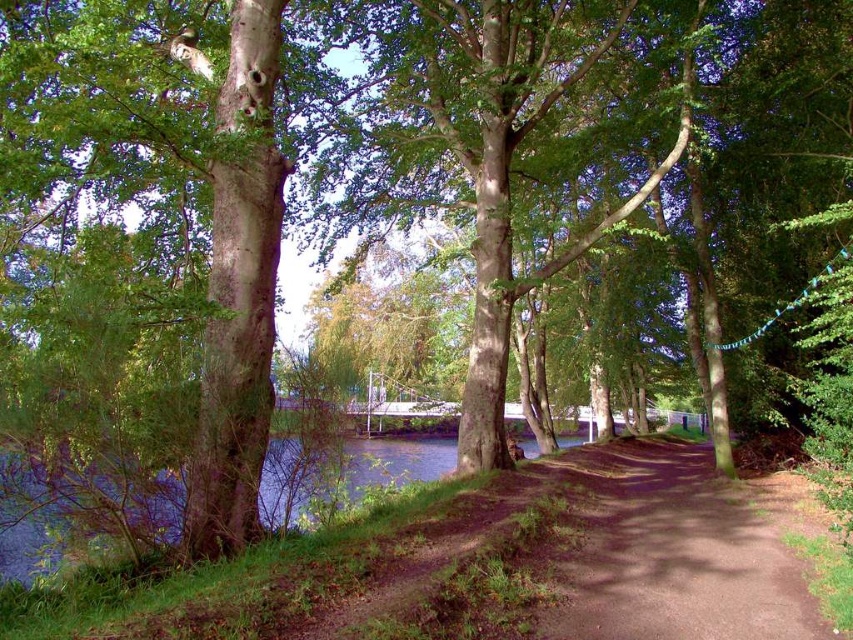
Based on the photo, you are a hiker walking along the brown dirt path at center. You notice the green leafy tree at center ahead. Can you walk under the tree without leaving the path?

The green leafy tree at center is bigger than the brown dirt path at center, so yes, you can walk under the tree without leaving the path because the tree is wider than the path.

Consider the image. You are walking along the brown dirt path at center and want to take a photo of the green leafy tree at center. Which direction should you face to capture the tree in your viewfinder?

The green leafy tree at center is positioned on the left side of brown dirt path at center, so you should face to the left to capture the tree in your viewfinder.

You are standing at the riverside and want to take a photo of the green leafy tree at center. If your camera can focus on objects up to 40 feet away, will it be able to capture the tree clearly?

The green leafy tree at center is 39.67 feet away from the camera, which is within the camera focus range of up to 40 feet. Therefore, the camera should be able to capture the tree clearly.